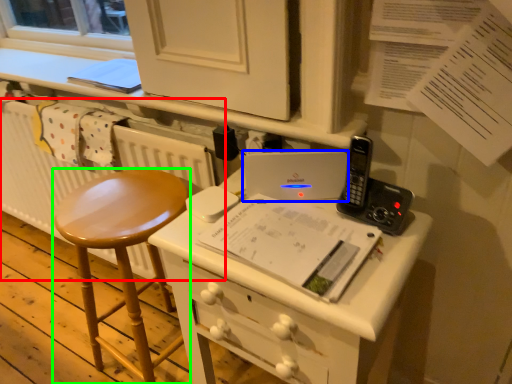
Question: Which is nearer to the radiator (highlighted by a red box)? laptop (highlighted by a blue box) or stool (highlighted by a green box).

Choices:
 (A) laptop
 (B) stool

Answer: (B)